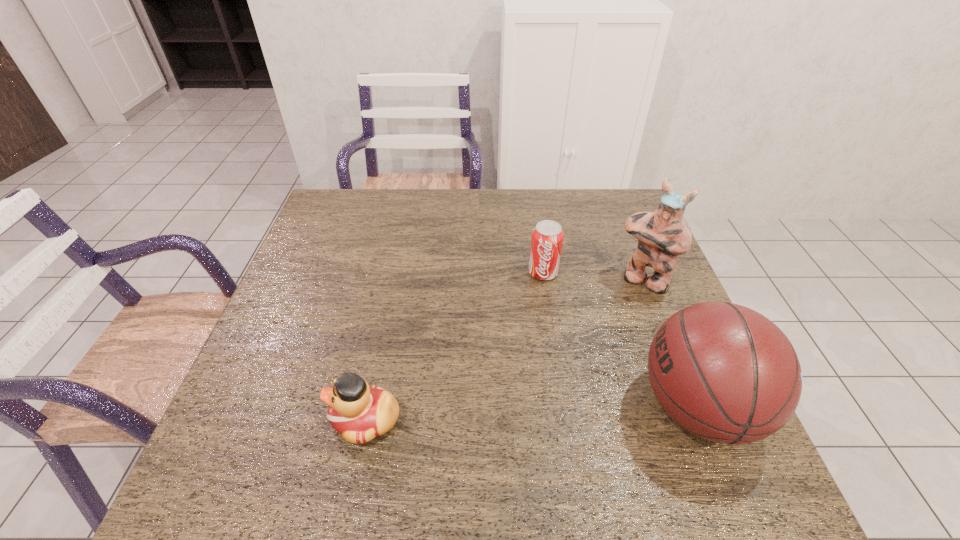
You are a GUI agent. You are given a task and a screenshot of the screen. Output one action in this format:
    pyautogui.click(x=<x>, y=<y>)
    Task: Click on the vacant space located on the logo side of the third object from right to left
    This screenshot has width=960, height=540.
    Given the screenshot: What is the action you would take?
    pyautogui.click(x=516, y=404)

You are a GUI agent. You are given a task and a screenshot of the screen. Output one action in this format:
    pyautogui.click(x=<x>, y=<y>)
    Task: Click on the free space located 0.350m on the logo side of the third object from right to left
    Image resolution: width=960 pixels, height=540 pixels.
    Given the screenshot: What is the action you would take?
    pyautogui.click(x=519, y=392)

The image size is (960, 540). I want to click on free region located on the front-facing side of the tallest object, so click(602, 339).

Where is `vacant space located 0.060m on the front-facing side of the tallest object`? vacant space located 0.060m on the front-facing side of the tallest object is located at coordinates (623, 307).

This screenshot has width=960, height=540. In order to click on blank space located on the front-facing side of the tallest object in this screenshot , I will do `click(584, 368)`.

Identify the location of duck positioned at the near edge. (359, 412).

Image resolution: width=960 pixels, height=540 pixels. I want to click on basketball present at the near edge, so click(722, 371).

In order to click on basketball located in the right edge section of the desktop in this screenshot , I will do `click(722, 371)`.

Image resolution: width=960 pixels, height=540 pixels. In order to click on figurine that is at the right edge in this screenshot , I will do `click(662, 235)`.

Where is `object that is at the near right corner`? This screenshot has width=960, height=540. object that is at the near right corner is located at coordinates (722, 371).